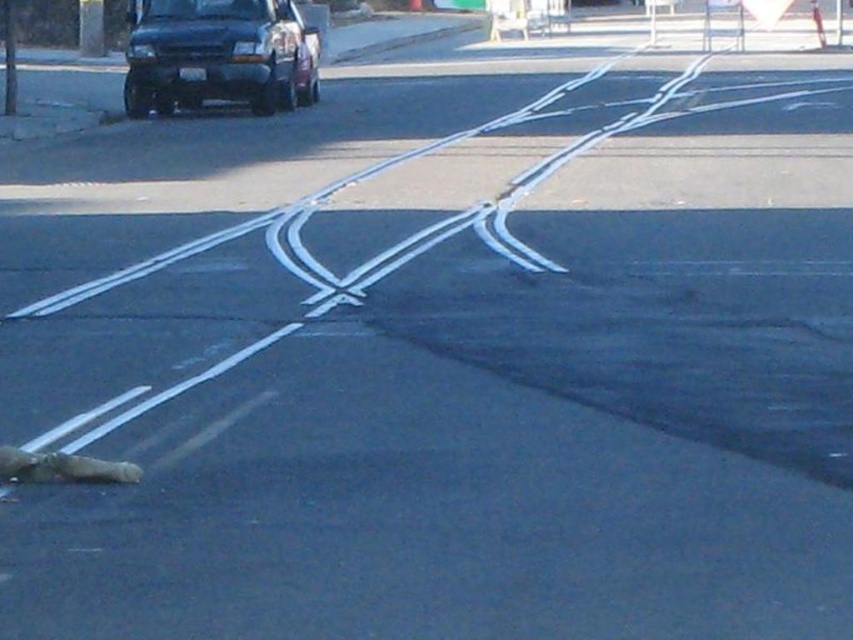
Is black matte van at upper left taller than brown fur animal at lower left?

Indeed, black matte van at upper left has a greater height compared to brown fur animal at lower left.

At what (x,y) coordinates should I click in order to perform the action: click on black matte van at upper left. Please return your answer as a coordinate pair (x, y). This screenshot has height=640, width=853. Looking at the image, I should click on (218, 54).